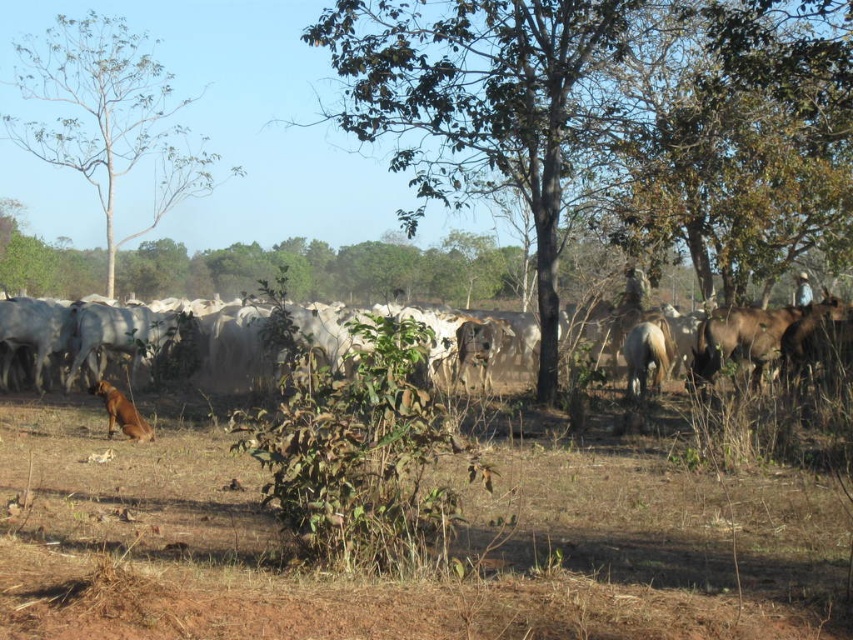
You are a farmer planning to plant new crops in the field between the green leafy tree at center and the green leafy tree at upper left. Considering the height difference between these two trees, which tree might cast a longer shadow in the afternoon, potentially affecting your crops?

The green leafy tree at center is much taller than the green leafy tree at upper left, so it will cast a longer shadow in the afternoon, which could affect the crops planted between them.

You are a farmer checking the herd. You notice the green leafy tree at upper left and the brown fur dog at lower left. Which one is larger in size?

The green leafy tree at upper left is bigger than the brown fur dog at lower left.

Looking at this image, you are a farmer looking for shade in the rural scene. You see the green leafy tree at center and the green leafy tree at upper left. Which tree would provide shade closer to the ground level?

The green leafy tree at center is below the green leafy tree at upper left, so it would provide shade closer to the ground level.